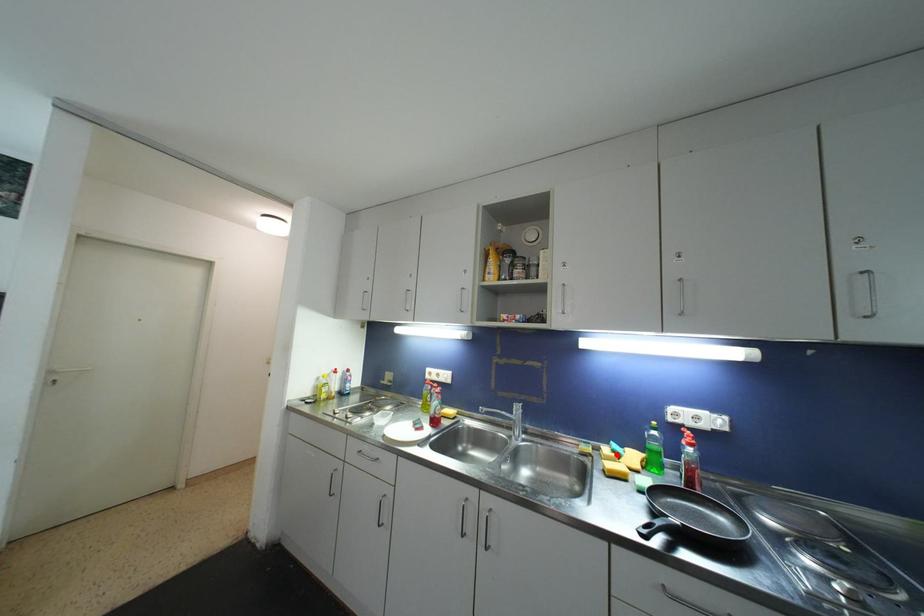
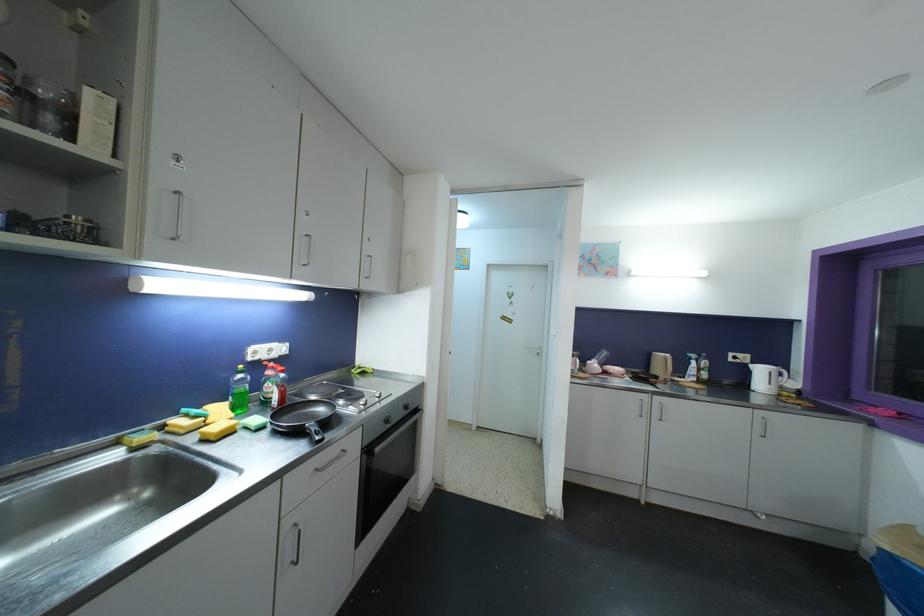
Locate, in the second image, the point that corresponds to the highlighted location in the first image.

(199, 419)